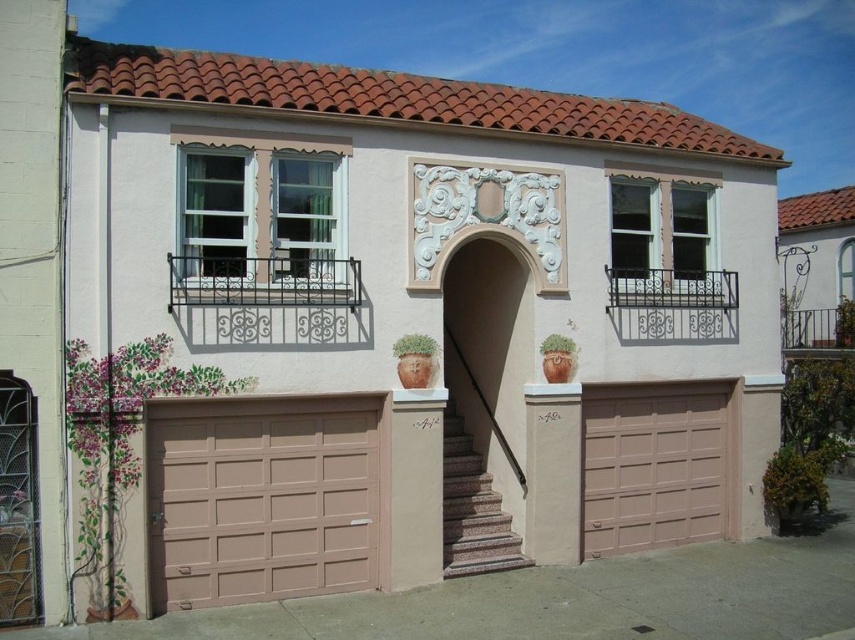
From the picture: You are a delivery person approaching the building and need to access the tan matte garage door at lower left. The granite stairs at center are in your path. Based on the scene description, can you reach the garage door without using the stairs?

The tan matte garage door at lower left is located above the granite stairs at center, so you would need to climb the granite stairs at center to access the tan matte garage door at lower left. Therefore, you cannot reach the garage door without using the stairs.

You are a delivery person trying to park your van in front of the tan matte garage door at lower left and the beige textured garage door at center. Since the van is quite large, you need to know which garage door is higher up to avoid hitting the van roof. Can you tell me which garage door is positioned higher?

The tan matte garage door at lower left is located above the beige textured garage door at center, so it is positioned higher up. You should park under the beige textured garage door at center to avoid hitting the van roof.

You are a delivery person needing to park a van that requires a 2.5 meter wide space. You see the tan matte garage door at lower left and the beige textured garage door at center. Which garage door has enough space for your van?

The beige textured garage door at center has a larger size than the tan matte garage door at lower left, so it can accommodate the van requiring a 2.5 meter wide space.